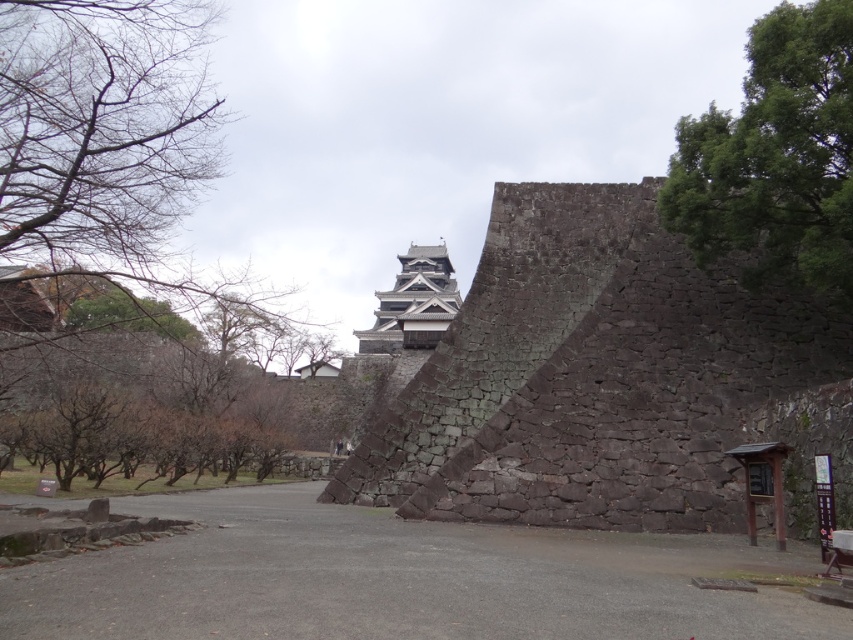
Between dark gray stone wall at center and green leafy tree at upper right, which one has more height?

dark gray stone wall at center is taller.

The width and height of the screenshot is (853, 640). What do you see at coordinates (590, 376) in the screenshot?
I see `dark gray stone wall at center` at bounding box center [590, 376].

Which is behind, point (496, 380) or point (822, 28)?

Positioned behind is point (496, 380).

Locate an element on the screen. dark gray stone wall at center is located at coordinates pyautogui.click(x=590, y=376).

Is gray asphalt path at center closer to the viewer compared to dark gray stone tower at center?

That is True.

Where is `gray asphalt path at center`? Image resolution: width=853 pixels, height=640 pixels. gray asphalt path at center is located at coordinates (401, 580).

Measure the distance between point (627,556) and camera.

A distance of 35.69 meters exists between point (627,556) and camera.

Find the location of `gray asphalt path at center`. gray asphalt path at center is located at coordinates (401, 580).

Where is `brown leafless tree at left`? The height and width of the screenshot is (640, 853). brown leafless tree at left is located at coordinates (136, 390).

This screenshot has height=640, width=853. Identify the location of brown leafless tree at left. (136, 390).